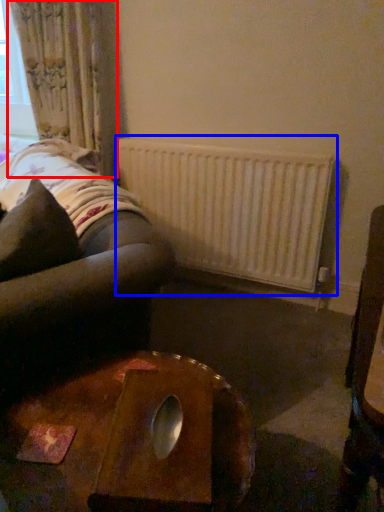
Question: Which point is further to the camera, curtain (highlighted by a red box) or radiator (highlighted by a blue box)?

Choices:
 (A) curtain
 (B) radiator

Answer: (A)